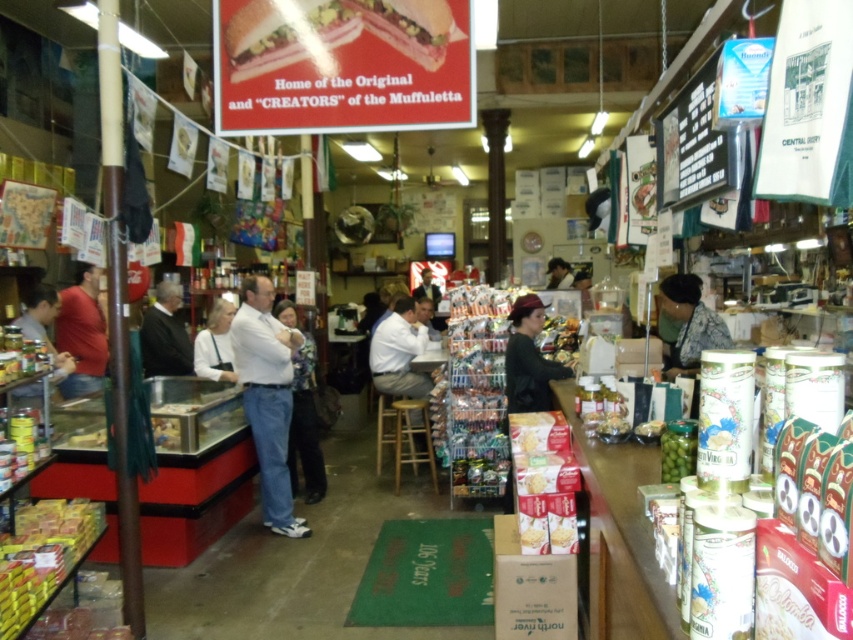
You are a customer at the deli counter and want to place an order. You notice two people at the counter wearing a white cotton shirt at center and a light brown leather jacket at center. Which of their clothing items has a larger width?

The white cotton shirt at center has a larger width than the light brown leather jacket at center according to the description.

You are a customer at the deli counter. You notice a matte red shirt at left and a green glass jar at lower right. Which item is wider?

The matte red shirt at left is wider than the green glass jar at lower right.

You are a customer at the deli counter. You want to place an order for a muffuletta sandwich. The counter has a matte black shirt at left and a green glass jar at lower right. Which item is wider when viewed from your perspective?

The matte black shirt at left is wider than the green glass jar at lower right.